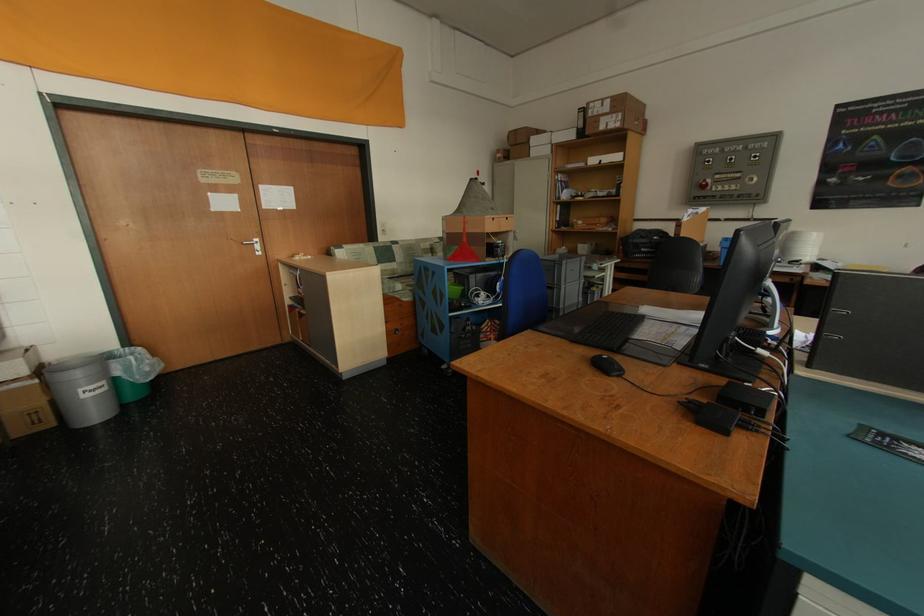
Where would you lift the black keyboard? Please return your answer as a coordinate pair (x, y).

(609, 330)